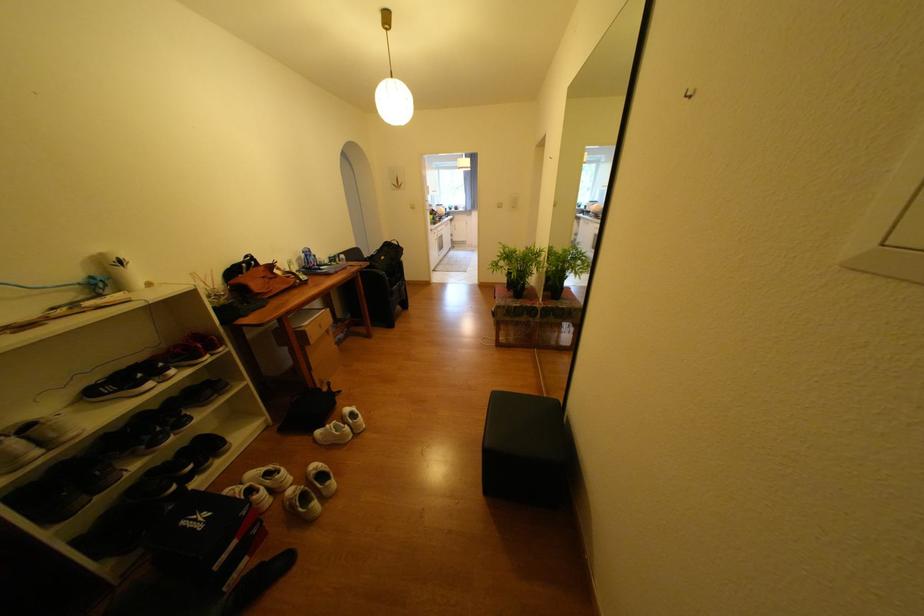
Locate an element on the screen. This screenshot has width=924, height=616. black plant pot is located at coordinates (517, 286).